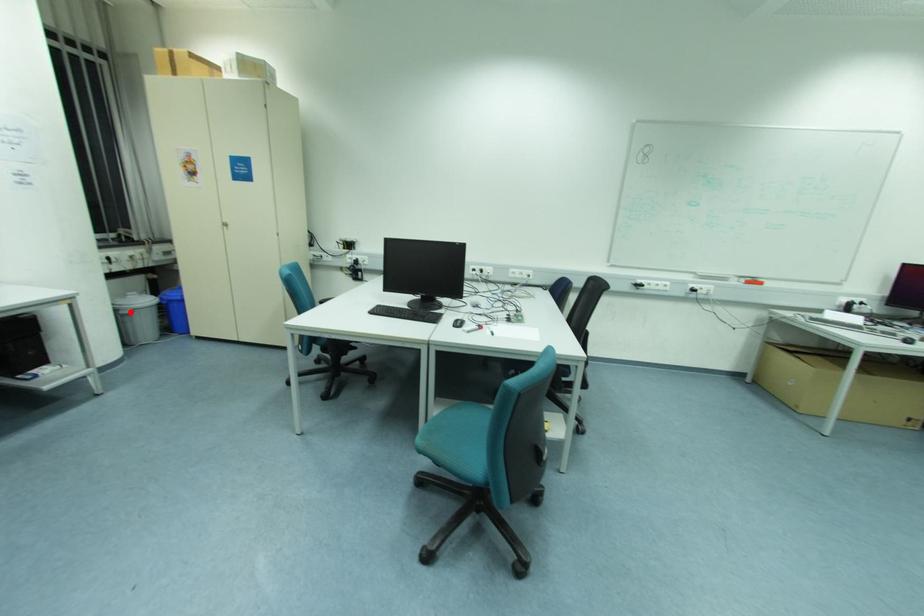
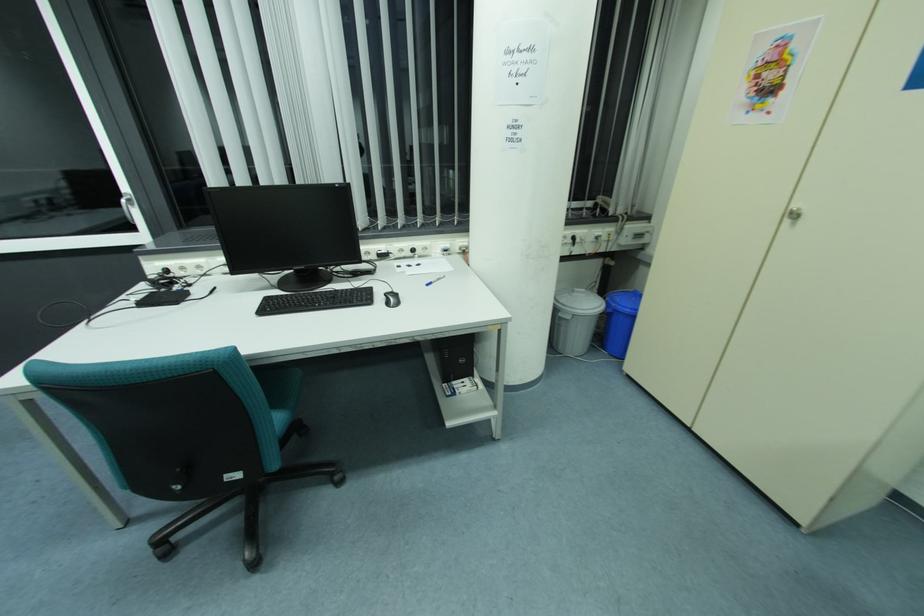
The point at the highlighted location is marked in the first image. Where is the corresponding point in the second image?

(568, 318)